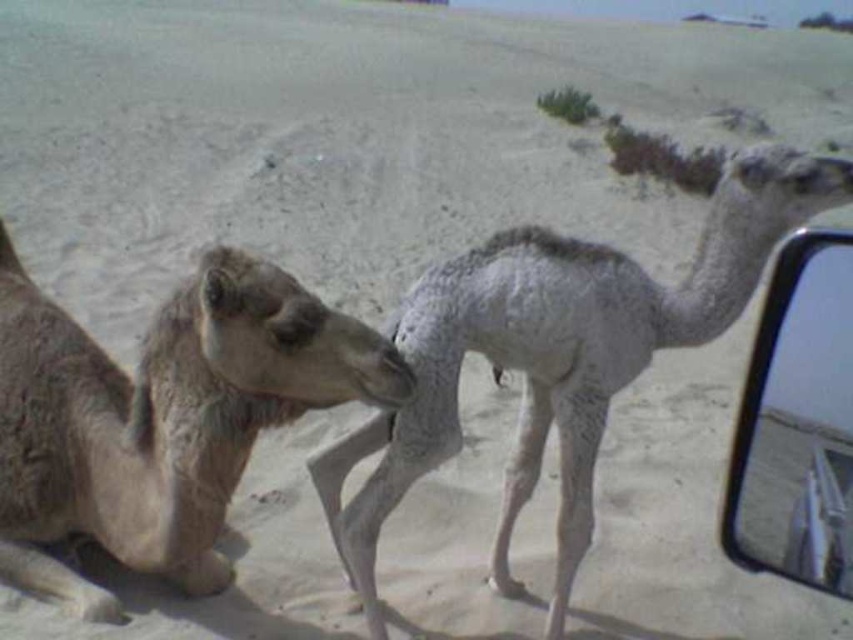
Which is behind, point (372, 492) or point (790, 368)?

Positioned behind is point (372, 492).

Is gray speckled camel at right taller than transparent plastic mirror at right?

Yes, gray speckled camel at right is taller than transparent plastic mirror at right.

Who is more forward, (x=518, y=419) or (x=741, y=490)?

Point (x=741, y=490) is more forward.

This screenshot has height=640, width=853. In order to click on gray speckled camel at right in this screenshot , I will do tap(556, 355).

The width and height of the screenshot is (853, 640). What do you see at coordinates (160, 417) in the screenshot?
I see `desert tan camel at left` at bounding box center [160, 417].

Who is positioned more to the right, desert tan camel at left or gray speckled camel at right?

gray speckled camel at right is more to the right.

Locate an element on the screen. The image size is (853, 640). desert tan camel at left is located at coordinates (160, 417).

I want to click on desert tan camel at left, so click(x=160, y=417).

Measure the distance between point [215,285] and camera.

The distance of point [215,285] from camera is 6.80 feet.

You are a GUI agent. You are given a task and a screenshot of the screen. Output one action in this format:
    pyautogui.click(x=<x>, y=<y>)
    Task: Click on the desert tan camel at left
    The image size is (853, 640).
    Given the screenshot: What is the action you would take?
    pyautogui.click(x=160, y=417)